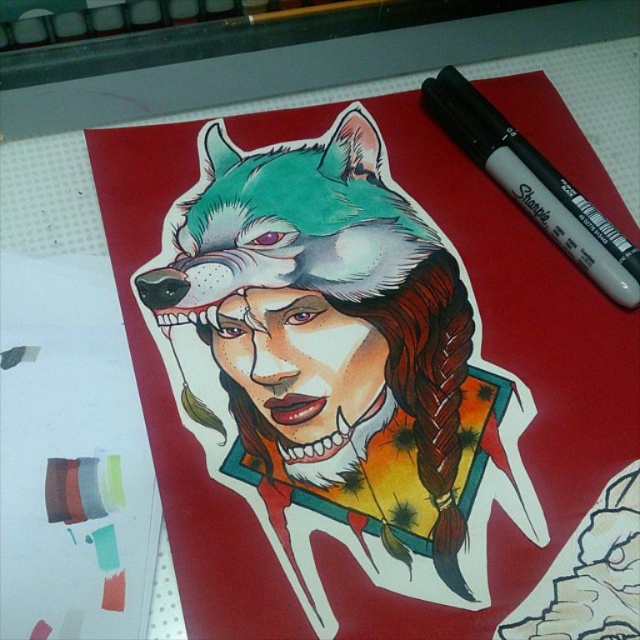
Which is behind, point (333, 204) or point (516, 204)?

The point (516, 204) is behind.

Is point (438, 525) farther from viewer compared to point (524, 141)?

No, (438, 525) is in front of (524, 141).

Locate an element on the screen. shiny metallic wolf head at center is located at coordinates tap(337, 365).